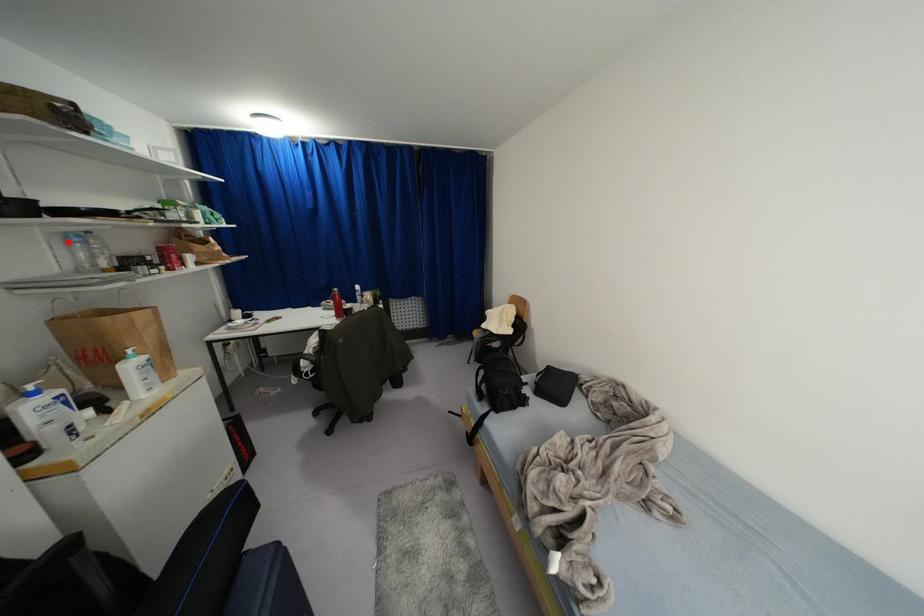
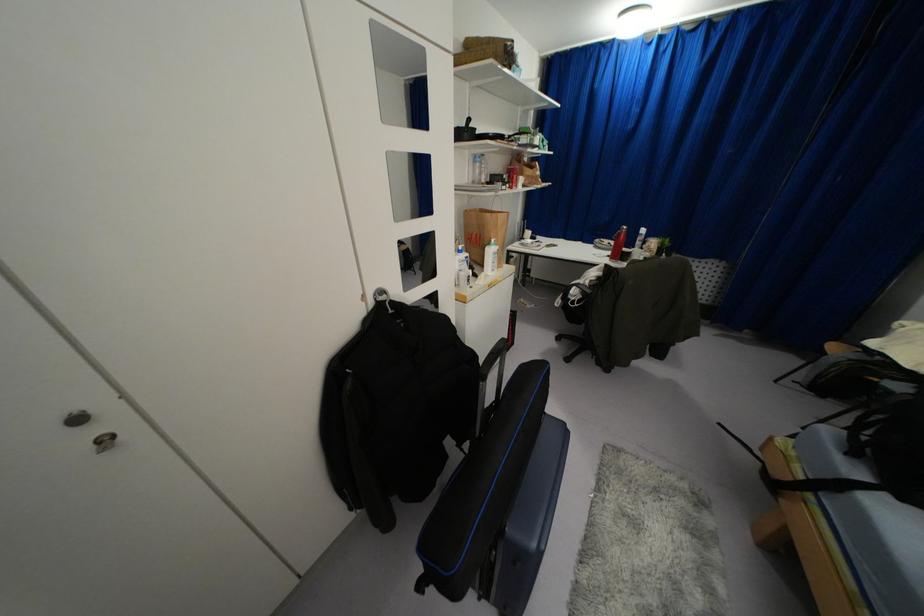
Question: I am providing you with two images of the same scene from different viewpoints. In image1, a red point is highlighted. Considering the same 3D point in image2, which of the following is correct?

Choices:
 (A) It is closer
 (B) It is farther

Answer: (A)